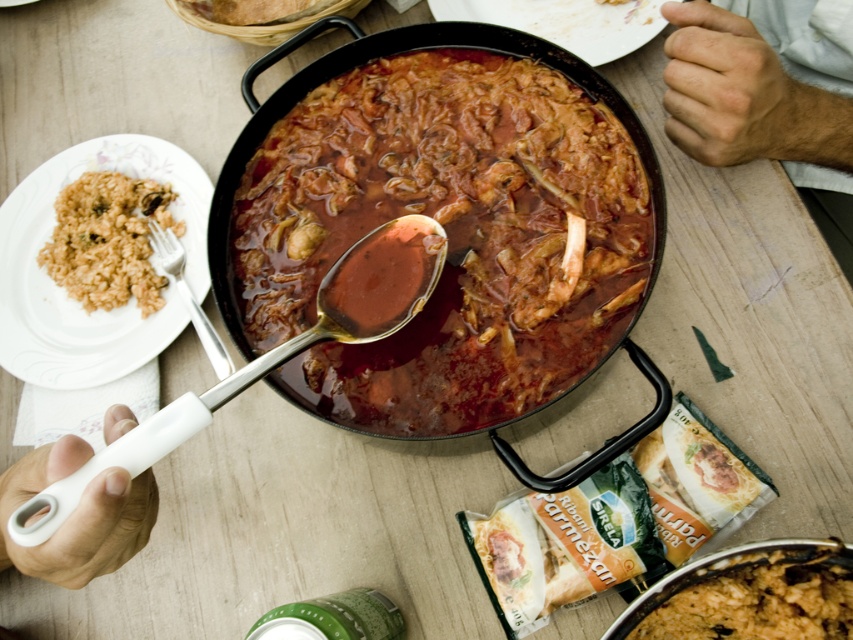
You are a photographer taking a close up shot of the communal dining setup. You notice two points marked in the image. Which point is closer to your camera, point (25, 269) or point (90, 458)?

Point (25, 269) is closer to the camera than point (90, 458).